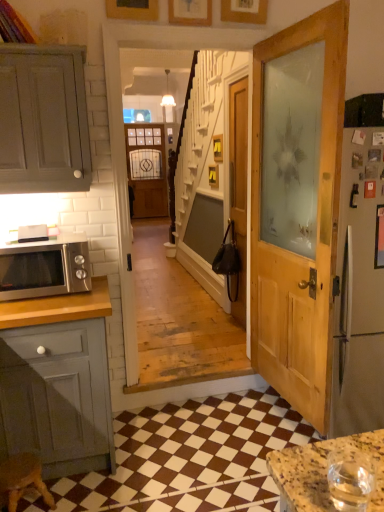
Measure the distance between matte wooden screen door at center and camera.

They are 22.95 feet apart.

Image resolution: width=384 pixels, height=512 pixels. Find the location of `matte wooden screen door at center`. matte wooden screen door at center is located at coordinates (147, 169).

What do you see at coordinates (191, 457) in the screenshot? I see `brown checkered tile at lower center` at bounding box center [191, 457].

Measure the distance between brown wooden stool at lower left and camera.

A distance of 1.84 meters exists between brown wooden stool at lower left and camera.

What is the approximate height of wooden door at center?

1.96 meters.

Where is `matte gray cabinet at left`? matte gray cabinet at left is located at coordinates (43, 120).

Measure the distance between point (236, 16) and camera.

Point (236, 16) is 2.34 meters away from camera.

The image size is (384, 512). Find the location of `matte wooden screen door at center`. matte wooden screen door at center is located at coordinates (147, 169).

Could you tell me if satin silver microwave at left is facing wooden picture frame at upper center, the 1th picture frame viewed from the left?

No.

Which object is further away from the camera taking this photo, satin silver microwave at left or wooden picture frame at upper center, the 1th picture frame viewed from the left?

wooden picture frame at upper center, the 1th picture frame viewed from the left.

Is satin silver microwave at left far from wooden picture frame at upper center, the 3th picture frame viewed from the right?

That's right, there is a large distance between satin silver microwave at left and wooden picture frame at upper center, the 3th picture frame viewed from the right.

Who is smaller, satin silver microwave at left or wooden picture frame at upper center, the 3th picture frame viewed from the right?

Smaller between the two is wooden picture frame at upper center, the 3th picture frame viewed from the right.

In terms of height, does matte gray cabinet at left look taller or shorter compared to satin silver microwave at left?

Clearly, matte gray cabinet at left is taller compared to satin silver microwave at left.

In the image, is matte gray cabinet at left on the left side or the right side of satin silver microwave at left?

matte gray cabinet at left is to the right of satin silver microwave at left.

Can you confirm if matte gray cabinet at left is thinner than satin silver microwave at left?

Correct, the width of matte gray cabinet at left is less than that of satin silver microwave at left.

Who is bigger, matte gray cabinet at left or satin silver microwave at left?

matte gray cabinet at left.

From the image's perspective, who appears lower, brown checkered tile at lower center or wooden picture frame at upper center, the 1th picture frame viewed from the left?

brown checkered tile at lower center.

From a real-world perspective, is brown checkered tile at lower center physically below wooden picture frame at upper center, the 3th picture frame viewed from the right?

Yes, from a real-world perspective, brown checkered tile at lower center is beneath wooden picture frame at upper center, the 3th picture frame viewed from the right.

Could you measure the distance between brown checkered tile at lower center and wooden picture frame at upper center, the 3th picture frame viewed from the right?

brown checkered tile at lower center is 7.71 feet away from wooden picture frame at upper center, the 3th picture frame viewed from the right.

Is brown checkered tile at lower center aimed at wooden picture frame at upper center, the 3th picture frame viewed from the right?

No, brown checkered tile at lower center is not aimed at wooden picture frame at upper center, the 3th picture frame viewed from the right.

Looking at this image, from the image's perspective, would you say matte gray cabinet at left is positioned over wooden picture frame at upper center, the 1th picture frame viewed from the left?

No, from the image's perspective, matte gray cabinet at left is not above wooden picture frame at upper center, the 1th picture frame viewed from the left.

The width and height of the screenshot is (384, 512). What are the coordinates of `cabinetry lying below the wooden picture frame at upper center, the 3th picture frame viewed from the right (from the image's perspective)` in the screenshot? It's located at (43, 120).

Considering the relative sizes of matte gray cabinet at left and wooden picture frame at upper center, the 1th picture frame viewed from the left, in the image provided, is matte gray cabinet at left bigger than wooden picture frame at upper center, the 1th picture frame viewed from the left,?

Yes, matte gray cabinet at left is bigger than wooden picture frame at upper center, the 1th picture frame viewed from the left.

Consider the image. What's the angular difference between matte gray cabinet at left and wooden picture frame at upper center, the 1th picture frame viewed from the left,'s facing directions?

The angle between the facing direction of matte gray cabinet at left and the facing direction of wooden picture frame at upper center, the 1th picture frame viewed from the left, is 1.23 degrees.

Is satin silver microwave at left far from matte gray cabinet at left?

No, there isn't a large distance between satin silver microwave at left and matte gray cabinet at left.

In the scene shown: Is satin silver microwave at left wider than matte gray cabinet at left?

Correct, the width of satin silver microwave at left exceeds that of matte gray cabinet at left.

Does satin silver microwave at left come behind matte gray cabinet at left?

Yes, it is behind matte gray cabinet at left.

Locate an element on the screen. cabinetry in front of the satin silver microwave at left is located at coordinates (43, 120).

Could you tell me if wooden picture frame at upper center, the 3th picture frame viewed from the right, is facing matte gray cabinet at left?

No, wooden picture frame at upper center, the 3th picture frame viewed from the right, is not oriented towards matte gray cabinet at left.

Consider the image. Can you confirm if wooden picture frame at upper center, the 1th picture frame viewed from the left, is smaller than matte gray cabinet at left?

Yes, wooden picture frame at upper center, the 1th picture frame viewed from the left, is smaller than matte gray cabinet at left.

Which object is positioned more to the right, wooden picture frame at upper center, the 3th picture frame viewed from the right, or matte gray cabinet at left?

wooden picture frame at upper center, the 3th picture frame viewed from the right, is more to the right.

Who is smaller, brown wooden stool at lower left or matte gray cabinet at left?

brown wooden stool at lower left is smaller.

In the image, there is a matte gray cabinet at left. Where is `stool below it (from the image's perspective)`? The image size is (384, 512). stool below it (from the image's perspective) is located at coordinates (22, 479).

Can you tell me how much brown wooden stool at lower left and matte gray cabinet at left differ in facing direction?

The facing directions of brown wooden stool at lower left and matte gray cabinet at left are 91.5 degrees apart.

Is brown wooden stool at lower left not within matte gray cabinet at left?

Yes.

Where is `microwave oven lying on the left of wooden picture frame at upper center, the 3th picture frame viewed from the right`? microwave oven lying on the left of wooden picture frame at upper center, the 3th picture frame viewed from the right is located at coordinates (45, 268).

Locate an element on the screen. cabinetry that appears above the satin silver microwave at left (from the image's perspective) is located at coordinates (43, 120).

Based on their spatial positions, is wooden door at center or matte wooden screen door at center closer to matte gray cabinet at left?

Based on the image, wooden door at center appears to be nearer to matte gray cabinet at left.

When comparing their distances from wooden picture frame at upper center, which is counted as the second picture frame, starting from the right, does satin silver microwave at left or matte gray cabinet at left seem further?

A: satin silver microwave at left lies further to wooden picture frame at upper center, which is counted as the second picture frame, starting from the right, than the other object.

Estimate the real-world distances between objects in this image. Which object is further from wooden picture frame at upper center, marked as the 2th picture frame in a left-to-right arrangement, brown wooden stool at lower left or matte gray cabinet at left?

brown wooden stool at lower left is further to wooden picture frame at upper center, marked as the 2th picture frame in a left-to-right arrangement.

Based on their spatial positions, is matte gray cabinet at left or brown wooden stool at lower left further from wooden picture frame at upper center, the 3th picture frame viewed from the right?

Based on the image, brown wooden stool at lower left appears to be further to wooden picture frame at upper center, the 3th picture frame viewed from the right.

Based on their spatial positions, is matte wooden screen door at center or wooden picture frame at upper center, the 1th picture frame viewed from the left, closer to matte gray cabinet at left?

Based on the image, wooden picture frame at upper center, the 1th picture frame viewed from the left, appears to be nearer to matte gray cabinet at left.

Which object lies further to the anchor point matte gray cabinet at left, matte wooden screen door at center or wooden picture frame at upper center, marked as the 2th picture frame in a left-to-right arrangement?

matte wooden screen door at center is further to matte gray cabinet at left.

Estimate the real-world distances between objects in this image. Which object is closer to matte gray cabinet at left, matte wooden screen door at center or satin silver microwave at left?

Based on the image, satin silver microwave at left appears to be nearer to matte gray cabinet at left.

Estimate the real-world distances between objects in this image. Which object is closer to wooden picture frame at upper center, the 3th picture frame viewed from the right, matte wooden screen door at center or wooden picture frame at upper center, which is counted as the second picture frame, starting from the right?

Among the two, wooden picture frame at upper center, which is counted as the second picture frame, starting from the right, is located nearer to wooden picture frame at upper center, the 3th picture frame viewed from the right.

You are a GUI agent. You are given a task and a screenshot of the screen. Output one action in this format:
    pyautogui.click(x=<x>, y=<y>)
    Task: Click on the stool that lies between wooden picture frame at upper center, which is counted as the second picture frame, starting from the right, and brown checkered tile at lower center from top to bottom
    The image size is (384, 512).
    Given the screenshot: What is the action you would take?
    pyautogui.click(x=22, y=479)

Find the location of a particular element. Image resolution: width=384 pixels, height=512 pixels. door between wooden picture frame at upper center, the first picture frame viewed from the right, and matte wooden screen door at center, along the z-axis is located at coordinates (238, 190).

Find the location of a particular element. The image size is (384, 512). cabinetry between wooden picture frame at upper center, marked as the 2th picture frame in a left-to-right arrangement, and satin silver microwave at left, in the vertical direction is located at coordinates (43, 120).

Locate an element on the screen. The height and width of the screenshot is (512, 384). door between wooden picture frame at upper center, the 1th picture frame viewed from the left, and brown checkered tile at lower center from top to bottom is located at coordinates point(238,190).